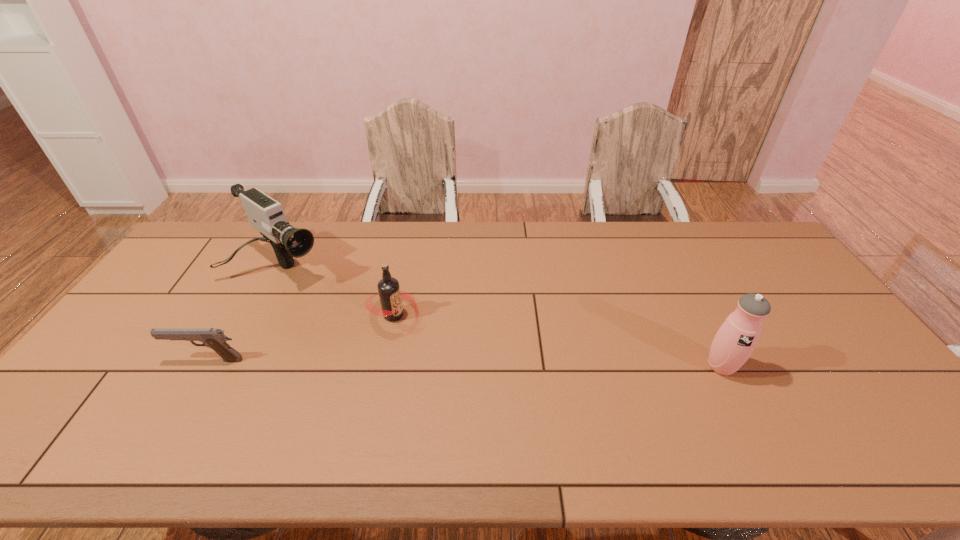
Where is `free space on the desktop that is between the shortest object and the rightmost object and is positioned on the label of the third object from left to right`? free space on the desktop that is between the shortest object and the rightmost object and is positioned on the label of the third object from left to right is located at coordinates (468, 363).

The image size is (960, 540). I want to click on vacant space on the desktop that is between the pistol and the thermos bottle and is positioned on the recording direction of the farthest object, so click(x=400, y=362).